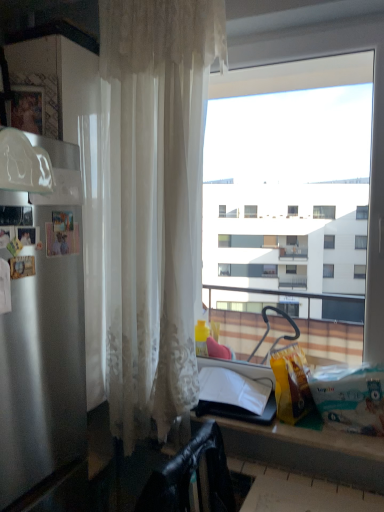
Question: Is matte black counter at lower center bigger or smaller than black leather chair at lower left?

Choices:
 (A) big
 (B) small

Answer: (A)

Question: From their relative heights in the image, would you say matte black counter at lower center is taller or shorter than black leather chair at lower left?

Choices:
 (A) short
 (B) tall

Answer: (A)

Question: Which is nearer to the satin silver refrigerator at left?

Choices:
 (A) transparent glass window at center
 (B) matte black counter at lower center
 (C) sheer white curtain at left
 (D) black leather chair at lower left

Answer: (C)

Question: Which of these objects is positioned farthest from the transparent glass window at center?

Choices:
 (A) satin silver refrigerator at left
 (B) black leather chair at lower left
 (C) sheer white curtain at left
 (D) matte black counter at lower center

Answer: (B)